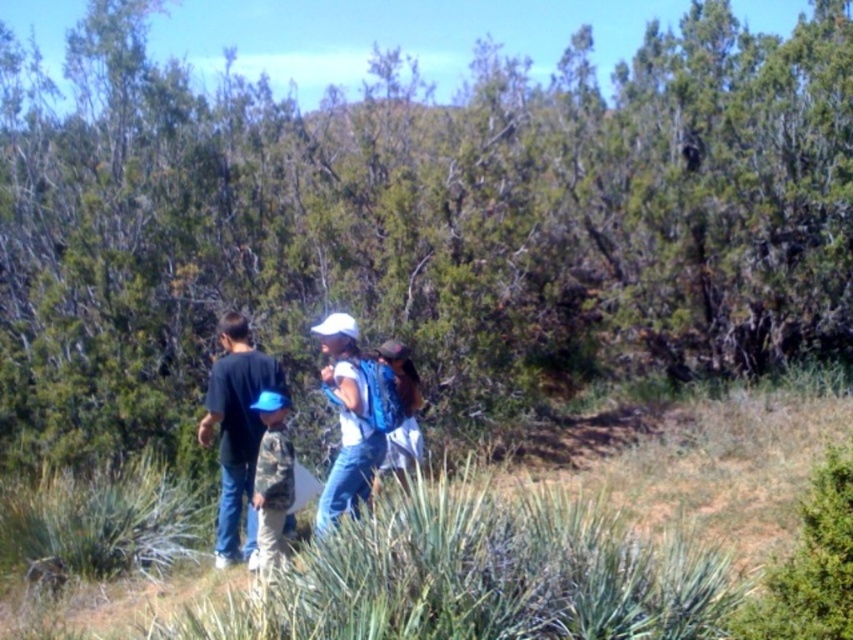
Question: Among these points, which one is farthest from the camera?

Choices:
 (A) (247, 493)
 (B) (384, 460)
 (C) (361, 461)

Answer: (A)

Question: Is white matte backpack at center in front of black cotton shirt at left?

Choices:
 (A) yes
 (B) no

Answer: (A)

Question: Which point appears farthest from the camera in this image?

Choices:
 (A) (207, 442)
 (B) (225, 362)

Answer: (B)

Question: Is white matte backpack at center bigger than blue backpack at center?

Choices:
 (A) yes
 (B) no

Answer: (A)

Question: Is white matte backpack at center to the right of black cotton shirt at left from the viewer's perspective?

Choices:
 (A) yes
 (B) no

Answer: (A)

Question: Which object is the farthest from the blue backpack at center?

Choices:
 (A) black cotton shirt at left
 (B) white matte backpack at center

Answer: (A)